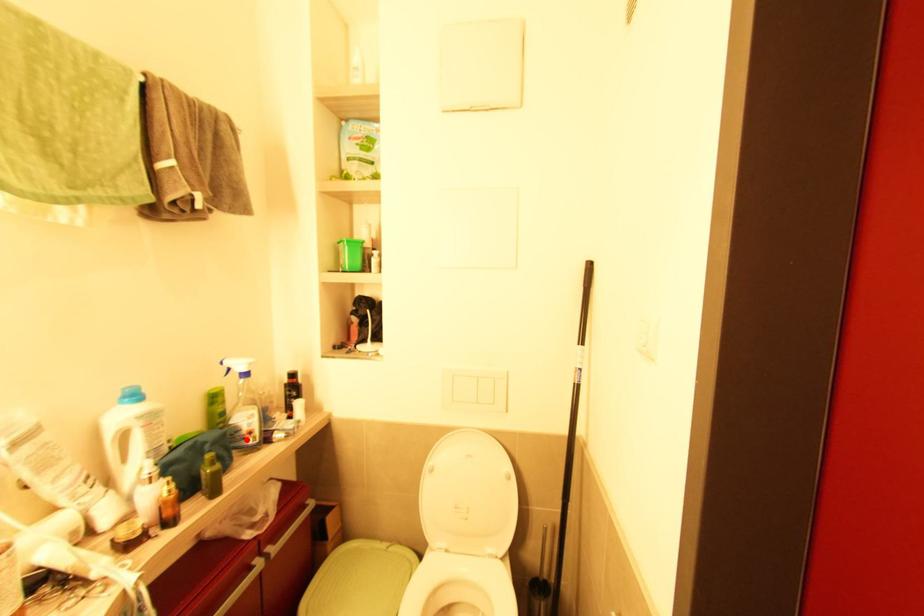
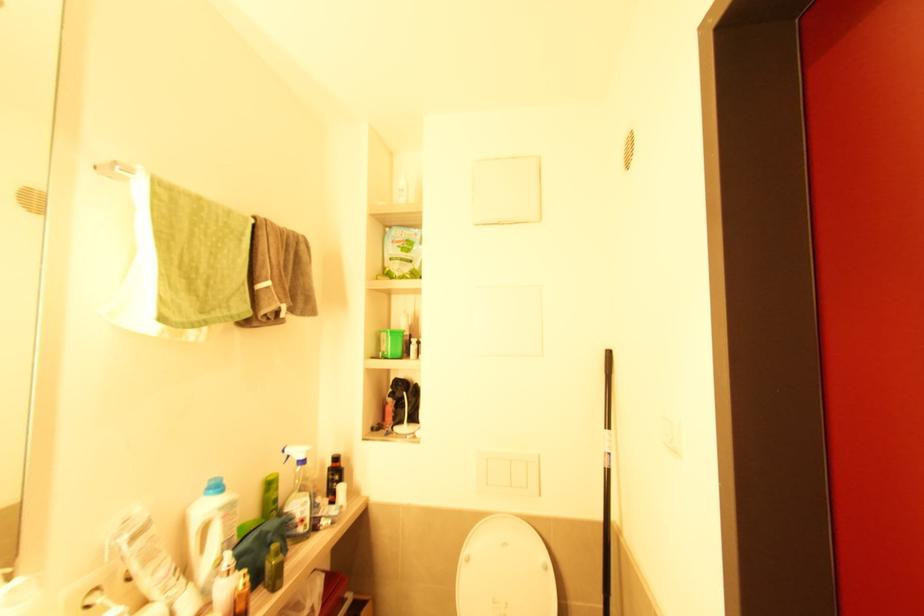
In the second image, find the point that corresponds to the highlighted location in the first image.

(298, 527)